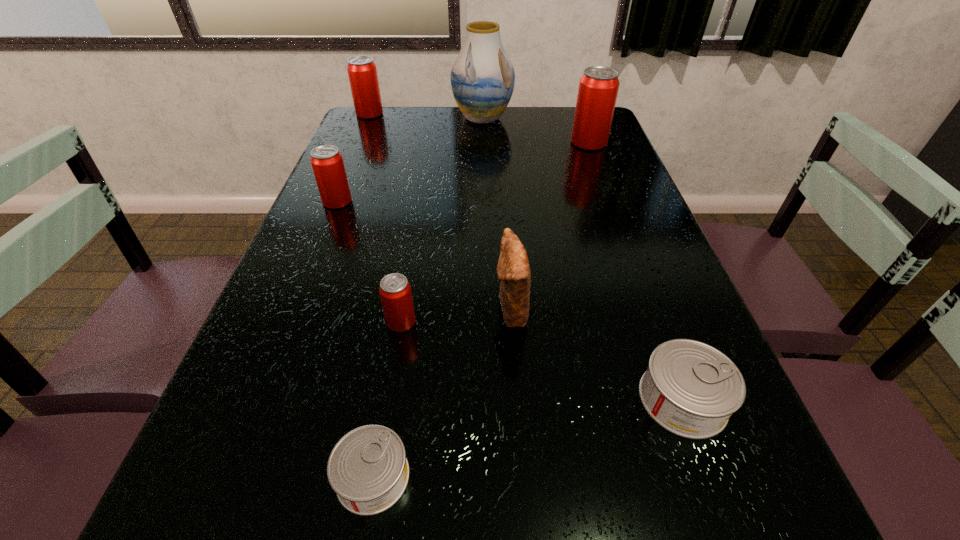
The width and height of the screenshot is (960, 540). Identify the location of vacant space at the far left corner of the desktop. (377, 137).

Locate an element on the screen. The height and width of the screenshot is (540, 960). vacant space that is in between the nearest object and the smallest red can is located at coordinates (387, 400).

This screenshot has width=960, height=540. I want to click on vacant space that is in between the second smallest red can and the nearest can, so click(x=355, y=339).

Identify the location of free spot between the vase and the farthest red can. The image size is (960, 540). (426, 116).

At what (x,y) coordinates should I click in order to perform the action: click on empty space between the third tallest can and the sixth nearest object. Please return your answer as a coordinate pair (x, y). This screenshot has width=960, height=540. Looking at the image, I should click on pos(463,172).

Locate an element on the screen. free area in between the clutch bag and the bigger silver can is located at coordinates (597, 354).

Locate an element on the screen. free space between the second nearest can and the smallest red can is located at coordinates (541, 361).

Identify the location of free space between the clutch bag and the third nearest red can. This screenshot has width=960, height=540. (550, 226).

You are a GUI agent. You are given a task and a screenshot of the screen. Output one action in this format:
    pyautogui.click(x=<x>, y=<y>)
    Task: Click on the free spot between the sixth tallest object and the second biggest red can
    The image size is (960, 540).
    Given the screenshot: What is the action you would take?
    pyautogui.click(x=385, y=218)

Locate an element on the screen. free space that is in between the smallest red can and the vase is located at coordinates (442, 220).